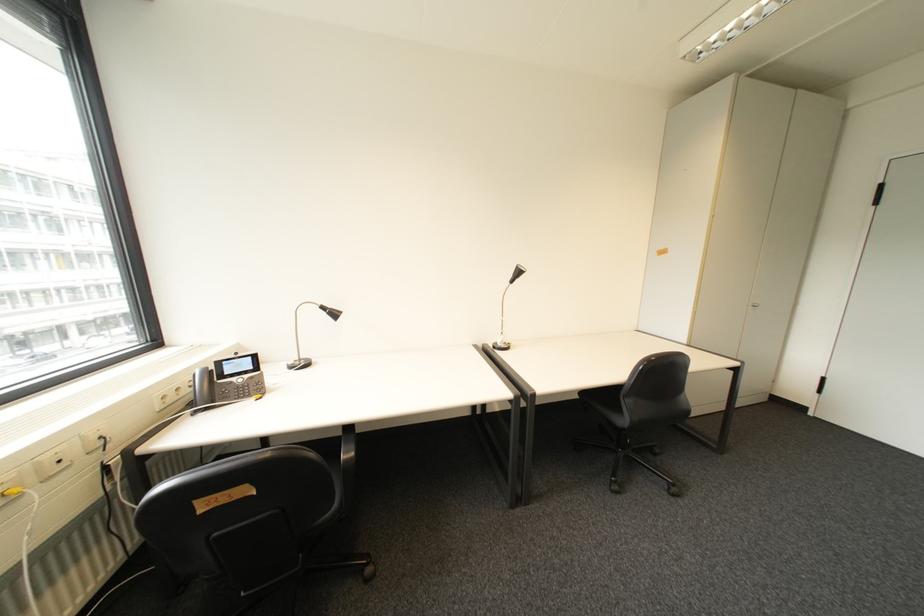
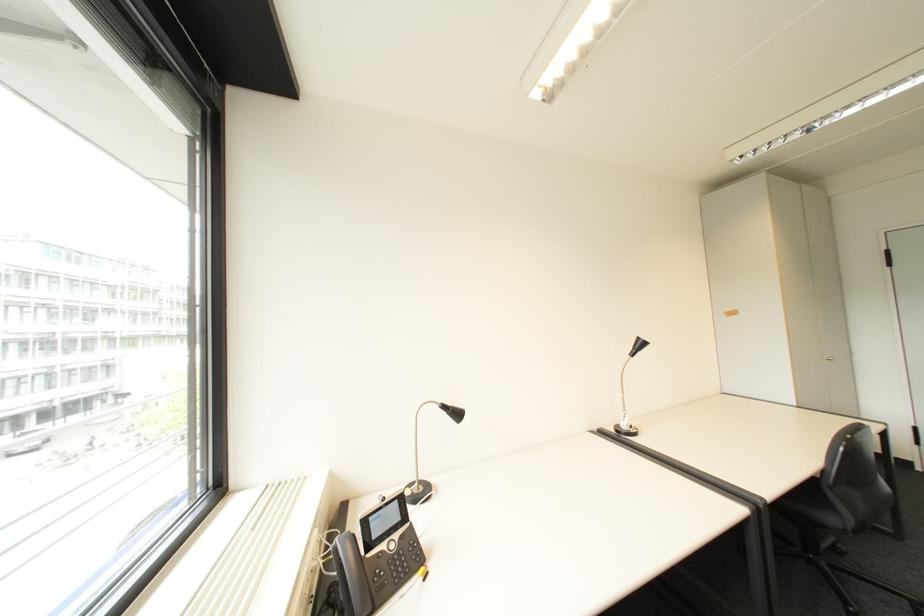
Find the pixel in the second image that matches (520,277) in the first image.

(640, 350)